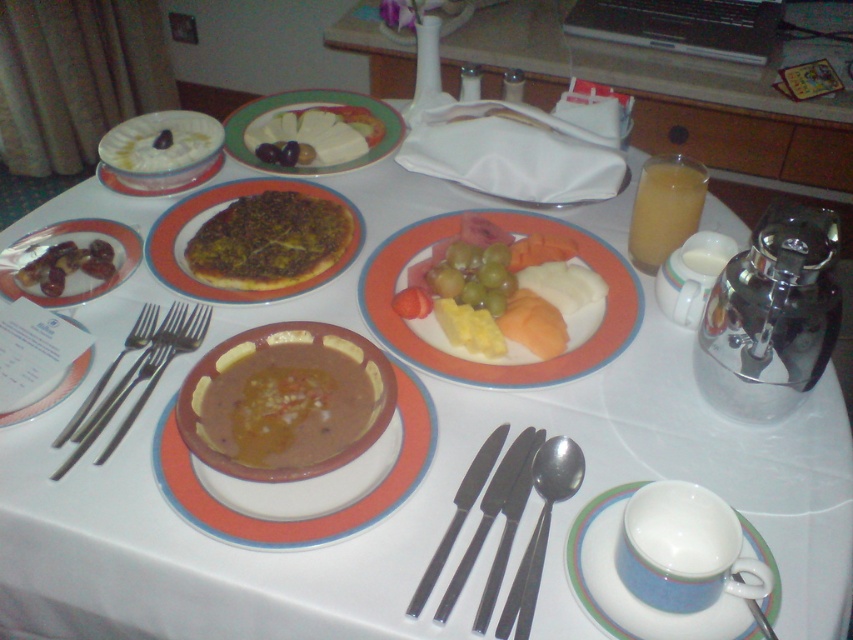
Between white ceramic plate at lower right and white ceramic plate at upper left, which one has less height?

white ceramic plate at lower right is shorter.

Measure the distance from white ceramic plate at lower right to white ceramic plate at upper left.

The distance of white ceramic plate at lower right from white ceramic plate at upper left is 24.72 inches.

Is point (587, 561) more distant than point (55, 397)?

No, (587, 561) is in front of (55, 397).

What are the coordinates of `white ceramic plate at lower right` in the screenshot? It's located at (625, 588).

How distant is white smooth cheese at center from silver metallic fork at left?

They are 18.82 inches apart.

Does point (291, 100) come behind point (148, 332)?

Yes, it is.

The height and width of the screenshot is (640, 853). In order to click on white smooth cheese at center in this screenshot , I will do `click(312, 131)`.

At what (x,y) coordinates should I click in order to perform the action: click on white smooth cheese at center. Please return your answer as a coordinate pair (x, y). The height and width of the screenshot is (640, 853). Looking at the image, I should click on (312, 131).

Does brown matte soup at center appear over white ceramic bowl at upper left?

Incorrect, brown matte soup at center is not positioned above white ceramic bowl at upper left.

Between point (196, 406) and point (207, 173), which one is positioned in front?

Point (196, 406)

Which is behind, point (264, 381) or point (184, 186)?

Point (184, 186)

Find the location of `brown matte soup at center`. brown matte soup at center is located at coordinates (286, 401).